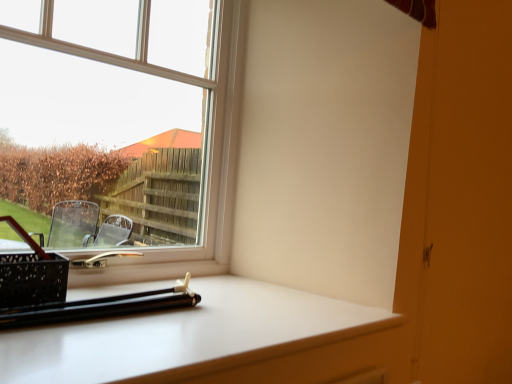
I want to click on clear glass window at upper left, so click(137, 114).

Looking at this image, in order to face clear glass window at upper left, should I rotate leftwards or rightwards?

To align with it, rotate left about 16.691°.

What is the approximate height of clear glass window at upper left?

The height of clear glass window at upper left is 34.56 inches.

Image resolution: width=512 pixels, height=384 pixels. What do you see at coordinates (137, 114) in the screenshot? I see `clear glass window at upper left` at bounding box center [137, 114].

What do you see at coordinates (217, 341) in the screenshot?
I see `white glossy computer desk at lower center` at bounding box center [217, 341].

What are the coordinates of `white glossy computer desk at lower center` in the screenshot? It's located at point(217,341).

Measure the distance between point (372, 370) and camera.

The depth of point (372, 370) is 1.05 meters.

I want to click on clear glass window at upper left, so tap(137, 114).

Would you say clear glass window at upper left is to the left or to the right of white glossy computer desk at lower center in the picture?

Clearly, clear glass window at upper left is on the left of white glossy computer desk at lower center in the image.

Based on the photo, does clear glass window at upper left come in front of white glossy computer desk at lower center?

No, the depth of clear glass window at upper left is greater than that of white glossy computer desk at lower center.

Between point (32, 42) and point (371, 353), which one is positioned behind?

The point (371, 353) is behind.

From the image's perspective, who appears lower, clear glass window at upper left or white glossy computer desk at lower center?

white glossy computer desk at lower center.

From a real-world perspective, relative to white glossy computer desk at lower center, is clear glass window at upper left vertically above or below?

clear glass window at upper left is situated higher than white glossy computer desk at lower center in the real world.

Between clear glass window at upper left and white glossy computer desk at lower center, which one has smaller width?

With smaller width is clear glass window at upper left.

Can you confirm if clear glass window at upper left is shorter than white glossy computer desk at lower center?

No, clear glass window at upper left is not shorter than white glossy computer desk at lower center.

Looking at the image, does clear glass window at upper left seem bigger or smaller compared to white glossy computer desk at lower center?

clear glass window at upper left is bigger than white glossy computer desk at lower center.

Is clear glass window at upper left outside of white glossy computer desk at lower center?

Yes, clear glass window at upper left is outside of white glossy computer desk at lower center.

Is clear glass window at upper left touching white glossy computer desk at lower center?

They are not placed beside each other.

Is white glossy computer desk at lower center at the back of clear glass window at upper left?

clear glass window at upper left is not turned away from white glossy computer desk at lower center.

Can you tell me how much clear glass window at upper left and white glossy computer desk at lower center differ in facing direction?

There is a 0.819-degree angle between the facing directions of clear glass window at upper left and white glossy computer desk at lower center.

Where is `computer desk on the right side of clear glass window at upper left`? This screenshot has height=384, width=512. computer desk on the right side of clear glass window at upper left is located at coordinates (217, 341).

Considering the relative positions of white glossy computer desk at lower center and clear glass window at upper left in the image provided, is white glossy computer desk at lower center to the right of clear glass window at upper left from the viewer's perspective?

Correct, you'll find white glossy computer desk at lower center to the right of clear glass window at upper left.

Does white glossy computer desk at lower center lie in front of clear glass window at upper left?

Yes, it is.

Which point is more forward, (375, 309) or (81, 247)?

The point (375, 309) is more forward.

From the image's perspective, between white glossy computer desk at lower center and clear glass window at upper left, who is located below?

white glossy computer desk at lower center is shown below in the image.

From a real-world perspective, relative to clear glass window at upper left, is white glossy computer desk at lower center vertically above or below?

Clearly, from a real-world perspective, white glossy computer desk at lower center is below clear glass window at upper left.

Is white glossy computer desk at lower center thinner than clear glass window at upper left?

In fact, white glossy computer desk at lower center might be wider than clear glass window at upper left.

Who is taller, white glossy computer desk at lower center or clear glass window at upper left?

clear glass window at upper left is taller.

From the picture: Considering the relative sizes of white glossy computer desk at lower center and clear glass window at upper left in the image provided, is white glossy computer desk at lower center bigger than clear glass window at upper left?

No.

Is white glossy computer desk at lower center not inside clear glass window at upper left?

Indeed, white glossy computer desk at lower center is completely outside clear glass window at upper left.

Is white glossy computer desk at lower center far from clear glass window at upper left?

No, white glossy computer desk at lower center is not far from clear glass window at upper left.

Is white glossy computer desk at lower center aimed at clear glass window at upper left?

No, white glossy computer desk at lower center is not facing towards clear glass window at upper left.

What's the angular difference between white glossy computer desk at lower center and clear glass window at upper left's facing directions?

There is a 0.819-degree angle between the facing directions of white glossy computer desk at lower center and clear glass window at upper left.

How far apart are white glossy computer desk at lower center and clear glass window at upper left?

21.30 inches.

Locate an element on the screen. computer desk that appears in front of the clear glass window at upper left is located at coordinates (217, 341).

Find the location of a particular element. Image resolution: width=512 pixels, height=384 pixels. computer desk below the clear glass window at upper left (from a real-world perspective) is located at coordinates pyautogui.click(x=217, y=341).

Locate an element on the screen. The image size is (512, 384). computer desk in front of the clear glass window at upper left is located at coordinates (217, 341).